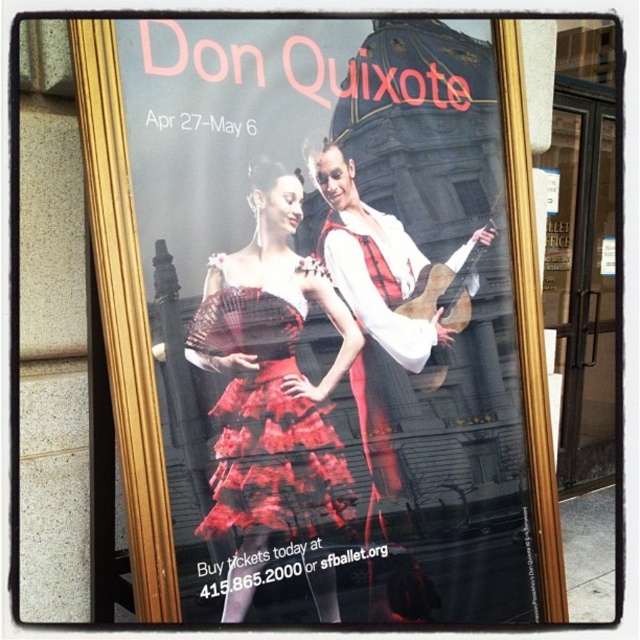
You are an art critic examining the ballet poster. You notice the matte black violin at center and the red lace dress at center. Which object is positioned higher in the image?

The matte black violin at center is above the red lace dress at center, so it is positioned higher in the image.

You are an art curator organizing an exhibition. You need to place a label next to both the matte black violin at center and the red lace dress at center. Since the label must be proportional to the object it describes, which object should have a larger label?

The matte black violin at center has a larger size compared to the red lace dress at center, so the label for the matte black violin at center should be larger.